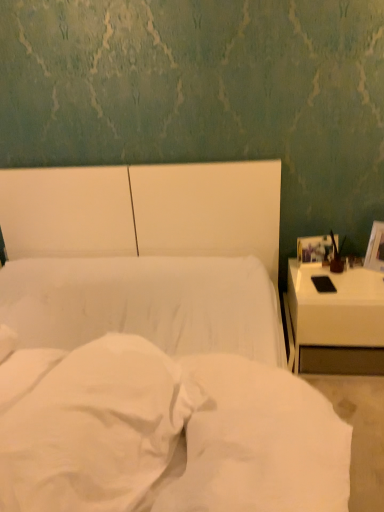
Question: Is matte brown vase at right in front of or behind white glossy nightstand at right in the image?

Choices:
 (A) behind
 (B) front

Answer: (A)

Question: From a real-world perspective, is matte brown vase at right physically located above or below white glossy nightstand at right?

Choices:
 (A) above
 (B) below

Answer: (A)

Question: Which of these objects is positioned farthest from the white fabric bed at center?

Choices:
 (A) white glossy nightstand at right
 (B) matte brown vase at right
 (C) white soft fabric at center
 (D) white soft pillow at center

Answer: (B)

Question: Which is nearer to the matte brown vase at right?

Choices:
 (A) white glossy nightstand at right
 (B) white soft fabric at center
 (C) white soft pillow at center
 (D) white fabric bed at center

Answer: (A)